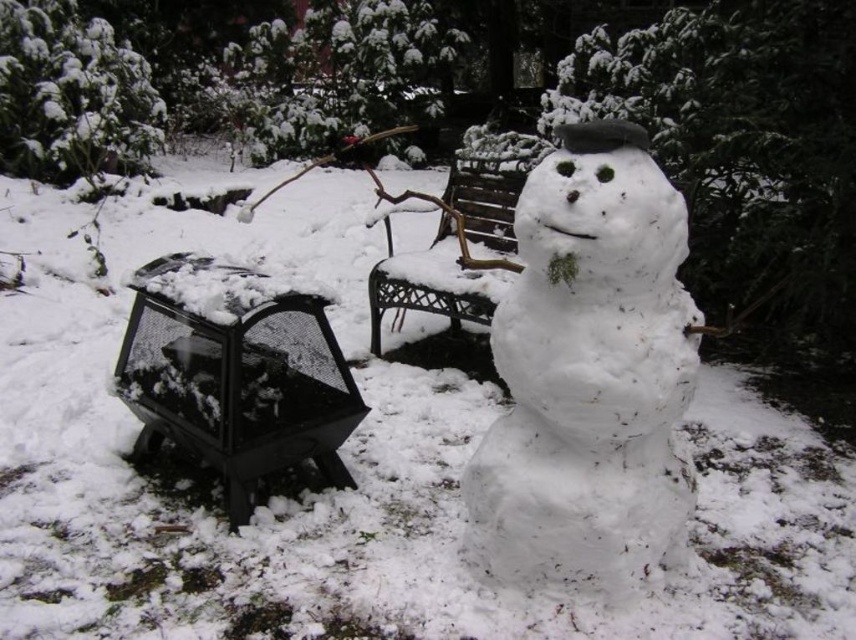
You are planning to build a new snowman next to the existing one. The new snowman should be the same size as the black mesh fire pit at lower left. Based on the scene, will the new snowman be smaller than the white fluffy snowman at center?

The white fluffy snowman at center is larger in size than the black mesh fire pit at lower left. Therefore, the new snowman, which is the same size as the black mesh fire pit at lower left, will be smaller than the white fluffy snowman at center.

You are standing in a snowy park and see the white fluffy snowman at center and the metallic brown bench at center. Which object is located to the right side of the other?

The white fluffy snowman at center is positioned on the right side of the metallic brown bench at center.